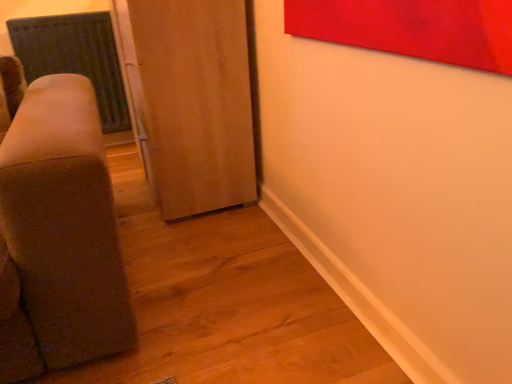
Question: Does point (170, 97) appear closer or farther from the camera than point (73, 31)?

Choices:
 (A) closer
 (B) farther

Answer: (A)

Question: From the image's perspective, is wooden door at center located above or below satin green radiator at left?

Choices:
 (A) below
 (B) above

Answer: (A)

Question: Based on their sizes in the image, would you say wooden door at center is bigger or smaller than satin green radiator at left?

Choices:
 (A) big
 (B) small

Answer: (A)

Question: Relative to wooden door at center, is satin green radiator at left in front or behind?

Choices:
 (A) behind
 (B) front

Answer: (A)

Question: Is satin green radiator at left to the left or to the right of wooden door at center in the image?

Choices:
 (A) left
 (B) right

Answer: (A)

Question: From a real-world perspective, is satin green radiator at left positioned above or below wooden door at center?

Choices:
 (A) above
 (B) below

Answer: (A)

Question: From the image's perspective, relative to wooden door at center, is satin green radiator at left above or below?

Choices:
 (A) below
 (B) above

Answer: (B)